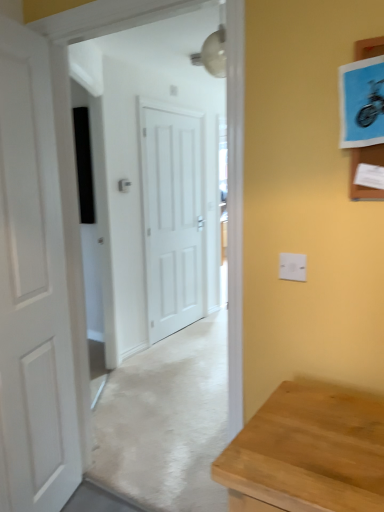
Identify the location of vacant area that is in front of white matte door at center, which appears as the second door when viewed from the left. (x=181, y=347).